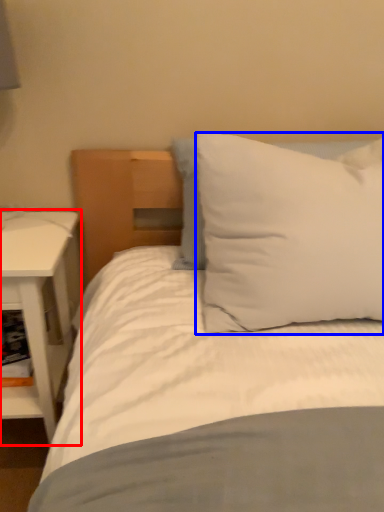
Question: Which object appears farthest to the camera in this image, nightstand (highlighted by a red box) or pillow (highlighted by a blue box)?

Choices:
 (A) nightstand
 (B) pillow

Answer: (A)